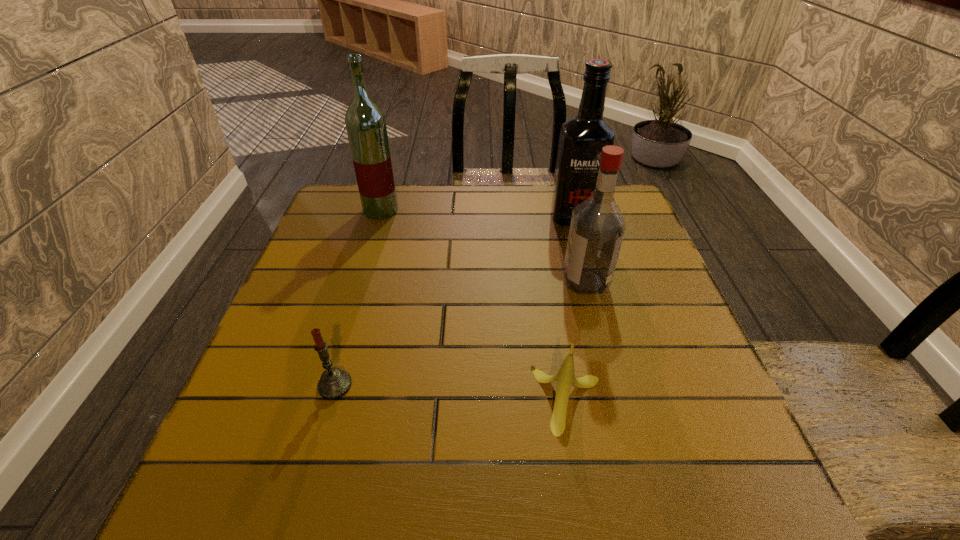
Find the location of a particular element. The height and width of the screenshot is (540, 960). vacant space positioned on the left of the shortest object is located at coordinates (490, 400).

The width and height of the screenshot is (960, 540). I want to click on liquor at the left edge, so click(365, 122).

Identify the location of candle that is at the left edge. (334, 383).

Where is `object that is at the far left corner`? object that is at the far left corner is located at coordinates (365, 122).

Locate an element on the screen. object present at the far right corner is located at coordinates (582, 138).

Image resolution: width=960 pixels, height=540 pixels. What are the coordinates of `vacant position at the far edge of the desktop` in the screenshot? It's located at (528, 224).

Find the location of a particular element. vacant space at the near edge of the desktop is located at coordinates (545, 464).

This screenshot has height=540, width=960. I want to click on free space at the left edge of the desktop, so click(x=295, y=309).

Locate an element on the screen. This screenshot has height=540, width=960. free space at the right edge of the desktop is located at coordinates (709, 372).

The width and height of the screenshot is (960, 540). I want to click on free space at the far left corner of the desktop, so click(x=361, y=207).